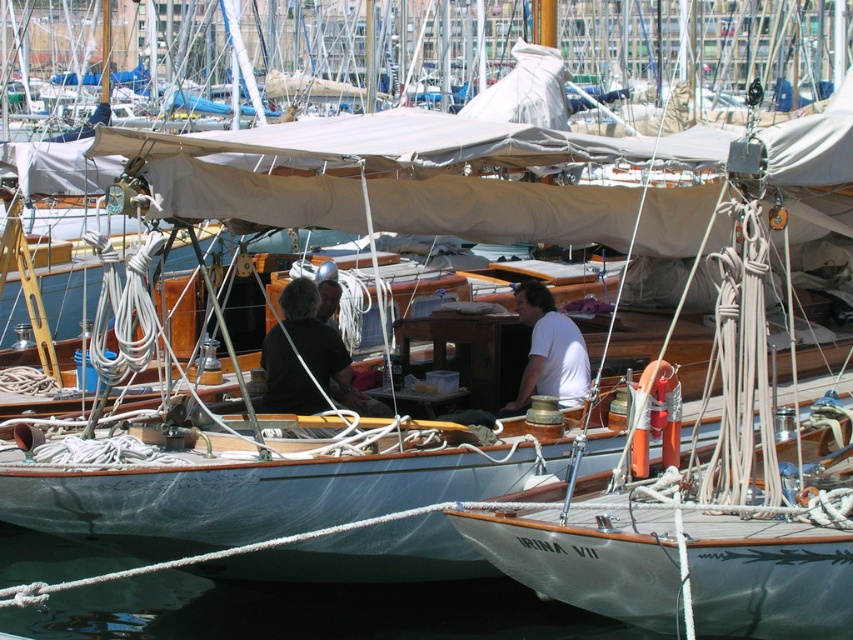
Is transparent water at lower left positioned at the back of white matte shirt at center?

That is False.

Is transparent water at lower left smaller than white matte shirt at center?

No.

Where is `transparent water at lower left`? The width and height of the screenshot is (853, 640). transparent water at lower left is located at coordinates (306, 611).

Measure the distance between transparent water at lower left and camera.

transparent water at lower left and camera are 18.94 meters apart from each other.

The width and height of the screenshot is (853, 640). What do you see at coordinates (306, 611) in the screenshot?
I see `transparent water at lower left` at bounding box center [306, 611].

Is point (47, 625) more distant than point (569, 401)?

No, (47, 625) is closer to viewer.

You are a GUI agent. You are given a task and a screenshot of the screen. Output one action in this format:
    pyautogui.click(x=<x>, y=<y>)
    Task: Click on the transparent water at lower left
    This screenshot has height=640, width=853.
    Given the screenshot: What is the action you would take?
    pyautogui.click(x=306, y=611)

Does dark brown leather couch at center appear under white matte shirt at center?

Yes, dark brown leather couch at center is below white matte shirt at center.

Can you confirm if dark brown leather couch at center is bigger than white matte shirt at center?

No, dark brown leather couch at center is not bigger than white matte shirt at center.

Who is more distant from viewer, (585, 356) or (517, 412)?

Point (517, 412)

Find the location of a particular element. This screenshot has height=640, width=853. dark brown leather couch at center is located at coordinates (549, 349).